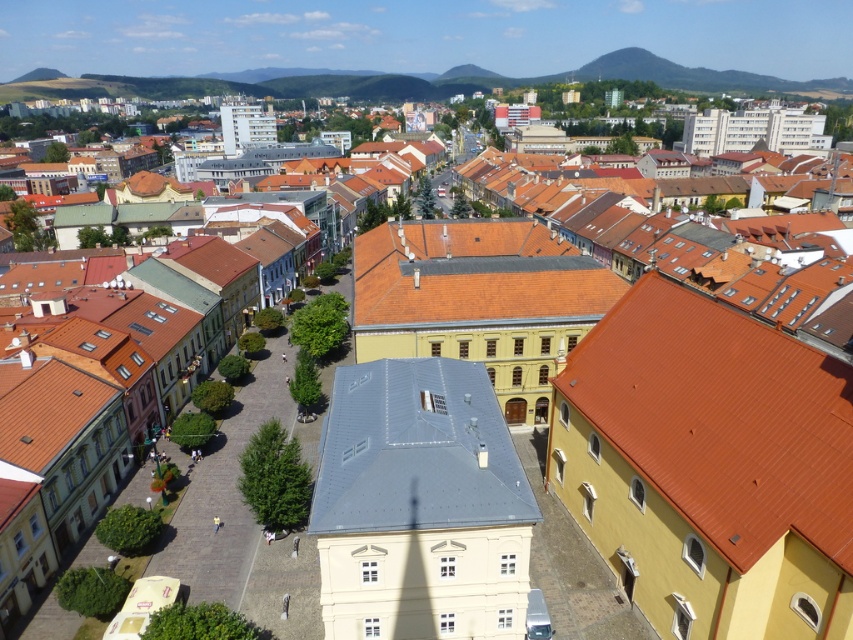
Question: Does gray slate roof at center lie behind orange tile roof at center?

Choices:
 (A) yes
 (B) no

Answer: (B)

Question: In this image, where is gray slate roof at center located relative to orange tile roof at center?

Choices:
 (A) above
 (B) below

Answer: (B)

Question: Which of these objects is positioned closest to the gray slate roof at center?

Choices:
 (A) orange tile roof at center right
 (B) orange tile roof at center

Answer: (A)

Question: Among these points, which one is farthest from the camera?

Choices:
 (A) (817, 512)
 (B) (396, 518)

Answer: (B)

Question: Observing the image, what is the correct spatial positioning of orange tile roof at center right in reference to gray slate roof at center?

Choices:
 (A) right
 (B) left

Answer: (A)

Question: Which object is closer to the camera taking this photo?

Choices:
 (A) orange tile roof at center right
 (B) gray slate roof at center

Answer: (A)